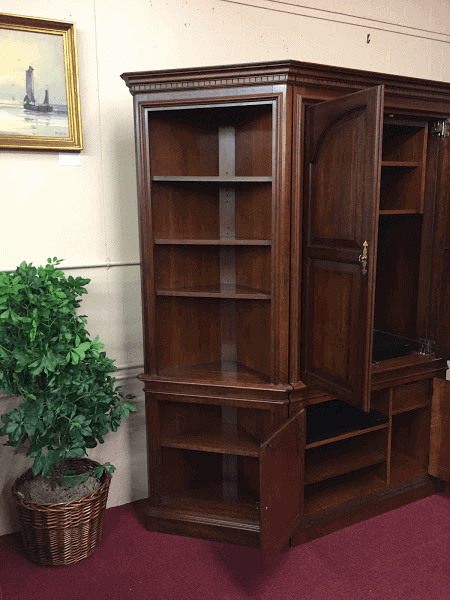
Image resolution: width=450 pixels, height=600 pixels. Find the location of `holder`. holder is located at coordinates (394, 12), (367, 37).